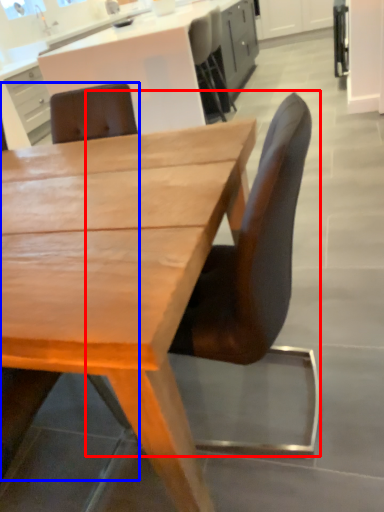
Question: Which point is closer to the camera, chair (highlighted by a red box) or chair (highlighted by a blue box)?

Choices:
 (A) chair
 (B) chair

Answer: (B)